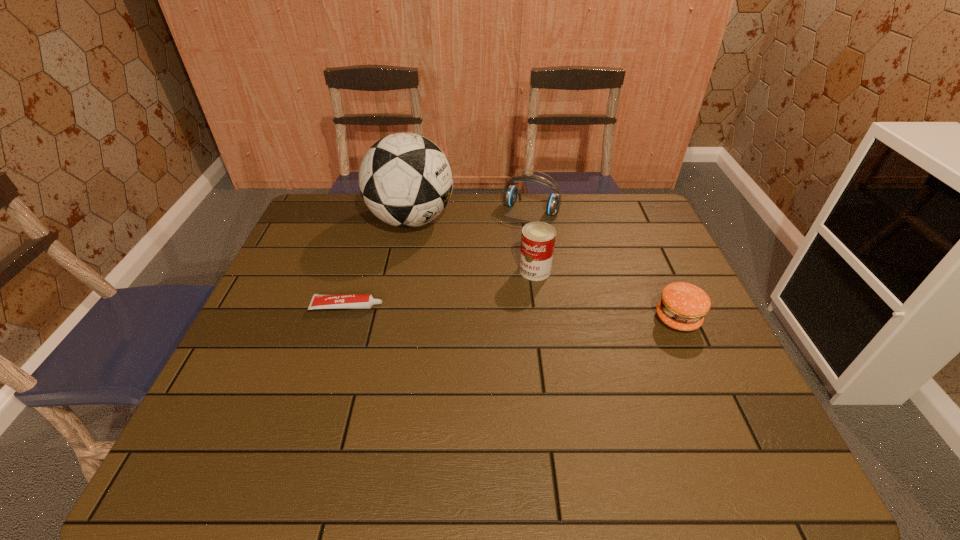
Where is `vacant region located on the surface of the tallest object where the brand logo is visible`? This screenshot has height=540, width=960. vacant region located on the surface of the tallest object where the brand logo is visible is located at coordinates (454, 266).

At what (x,y) coordinates should I click in order to perform the action: click on blank area located 0.340m on the ear cups of the headset. Please return your answer as a coordinate pair (x, y). The image size is (960, 540). Looking at the image, I should click on (486, 282).

The width and height of the screenshot is (960, 540). I want to click on vacant space located 0.200m on the ear cups of the headset, so click(x=502, y=253).

This screenshot has width=960, height=540. Find the location of `free space located 0.160m on the ear cups of the headset`. free space located 0.160m on the ear cups of the headset is located at coordinates (507, 246).

What are the coordinates of `vacant space located on the front label of the third farthest object` in the screenshot? It's located at (x=468, y=317).

Find the location of a particular element. The height and width of the screenshot is (540, 960). vacant area situated on the front label of the third farthest object is located at coordinates (477, 311).

Identify the location of vacant area situated on the front label of the third farthest object. Image resolution: width=960 pixels, height=540 pixels. (455, 327).

Image resolution: width=960 pixels, height=540 pixels. What are the coordinates of `soccer ball that is at the far edge` in the screenshot? It's located at (405, 179).

The height and width of the screenshot is (540, 960). Find the location of `headset that is at the far edge`. headset that is at the far edge is located at coordinates [510, 194].

The height and width of the screenshot is (540, 960). In order to click on object situated at the left edge in this screenshot , I will do pyautogui.click(x=352, y=301).